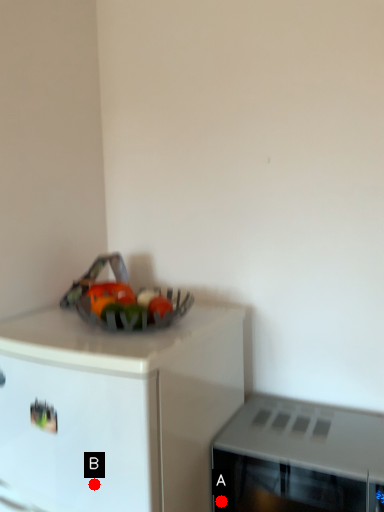
Question: Two points are circled on the image, labeled by A and B beside each circle. Among these points, which one is farthest from the camera?

Choices:
 (A) A is further
 (B) B is further

Answer: (A)